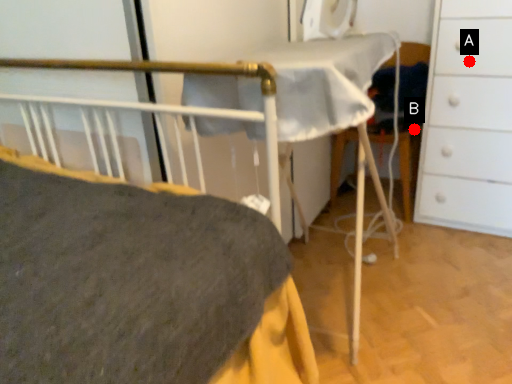
Question: Two points are circled on the image, labeled by A and B beside each circle. Which point is closer to the camera?

Choices:
 (A) A is closer
 (B) B is closer

Answer: (A)